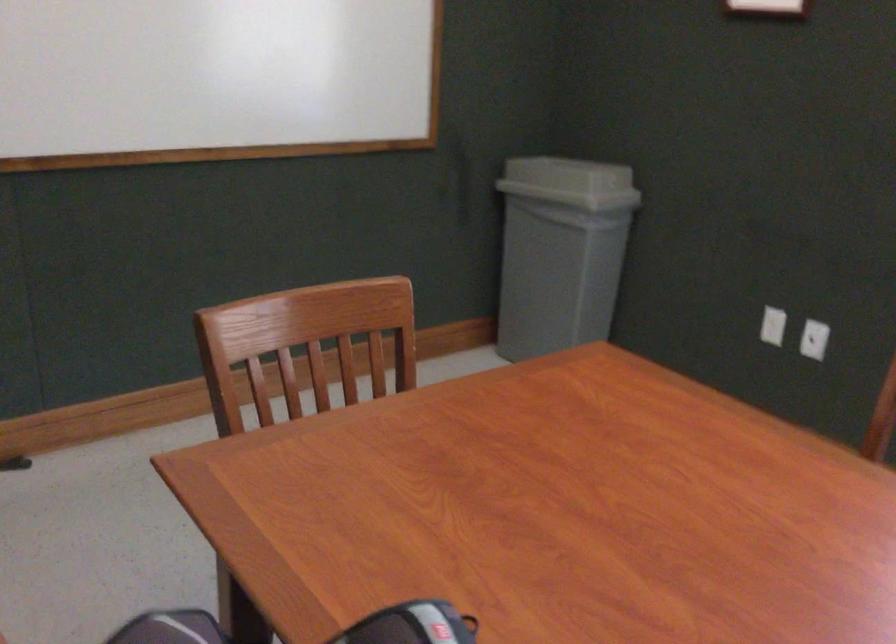
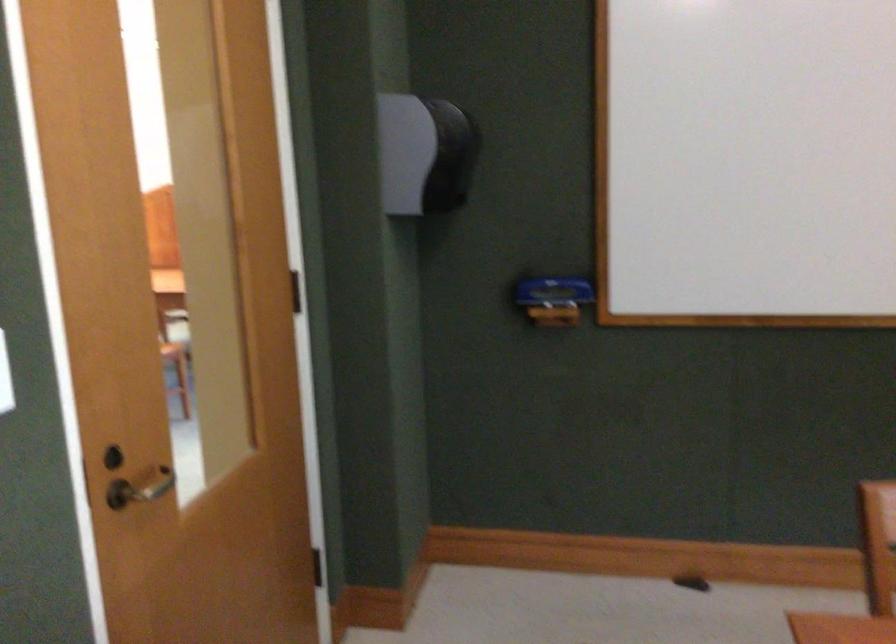
Question: The camera is either moving clockwise (left) or counter-clockwise (right) around the object. The first image is from the beginning of the video and the second image is from the end. Is the camera moving left or right when shooting the video?

Choices:
 (A) Left
 (B) Right

Answer: (B)